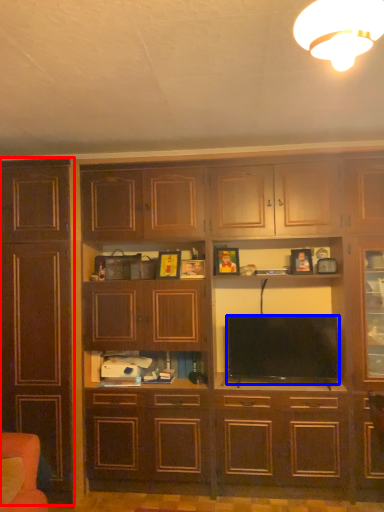
Question: Which of the following is the closest to the observer, cabinetry (highlighted by a red box) or television (highlighted by a blue box)?

Choices:
 (A) cabinetry
 (B) television

Answer: (A)